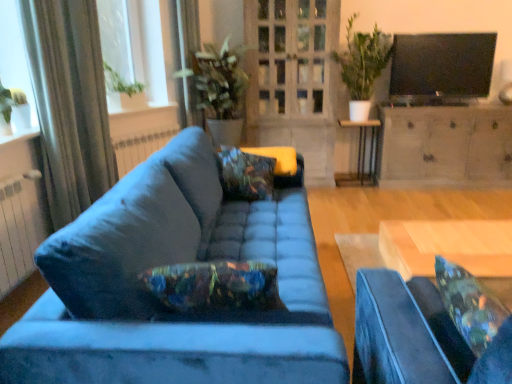
Question: Is the surface of floral fabric pillow at center in direct contact with velvet blue studio couch at center, the second studio couch from the left?

Choices:
 (A) yes
 (B) no

Answer: (B)

Question: From the image's perspective, is floral fabric pillow at center on top of velvet blue studio couch at center, the second studio couch from the left?

Choices:
 (A) no
 (B) yes

Answer: (B)

Question: Is floral fabric pillow at center aimed at velvet blue studio couch at center, the second studio couch from the left?

Choices:
 (A) yes
 (B) no

Answer: (A)

Question: Is floral fabric pillow at center shorter than velvet blue studio couch at center, which appears as the first studio couch when viewed from the right?

Choices:
 (A) yes
 (B) no

Answer: (A)

Question: Is floral fabric pillow at center looking in the opposite direction of velvet blue studio couch at center, which appears as the first studio couch when viewed from the right?

Choices:
 (A) yes
 (B) no

Answer: (B)

Question: From a real-world perspective, relative to black metal side table at center, is green fabric curtain at upper left, the 2th curtain from the front, vertically above or below?

Choices:
 (A) above
 (B) below

Answer: (A)

Question: Based on their sizes in the image, would you say green fabric curtain at upper left, which appears as the first curtain when viewed from the right, is bigger or smaller than black metal side table at center?

Choices:
 (A) big
 (B) small

Answer: (B)

Question: Is green fabric curtain at upper left, the 2th curtain from the front, situated inside black metal side table at center or outside?

Choices:
 (A) inside
 (B) outside

Answer: (B)

Question: Is green fabric curtain at upper left, the 2th curtain from the front, wider or thinner than black metal side table at center?

Choices:
 (A) thin
 (B) wide

Answer: (A)

Question: From a real-world perspective, relative to clear glass window at upper left, is green leafy plant at upper center, which is counted as the first houseplant, starting from the right, vertically above or below?

Choices:
 (A) above
 (B) below

Answer: (B)

Question: From their relative heights in the image, would you say green leafy plant at upper center, which is counted as the first houseplant, starting from the right, is taller or shorter than clear glass window at upper left?

Choices:
 (A) tall
 (B) short

Answer: (A)

Question: In the image, is green leafy plant at upper center, which appears as the second houseplant when viewed from the left, on the left side or the right side of clear glass window at upper left?

Choices:
 (A) right
 (B) left

Answer: (A)

Question: Is point (364, 77) positioned closer to the camera than point (3, 36)?

Choices:
 (A) farther
 (B) closer

Answer: (A)

Question: From a real-world perspective, is green leafy plant at upper center, which appears as the second houseplant when viewed from the left, physically located above or below black metal side table at center?

Choices:
 (A) below
 (B) above

Answer: (B)

Question: From their relative heights in the image, would you say green leafy plant at upper center, which is counted as the first houseplant, starting from the right, is taller or shorter than black metal side table at center?

Choices:
 (A) short
 (B) tall

Answer: (B)